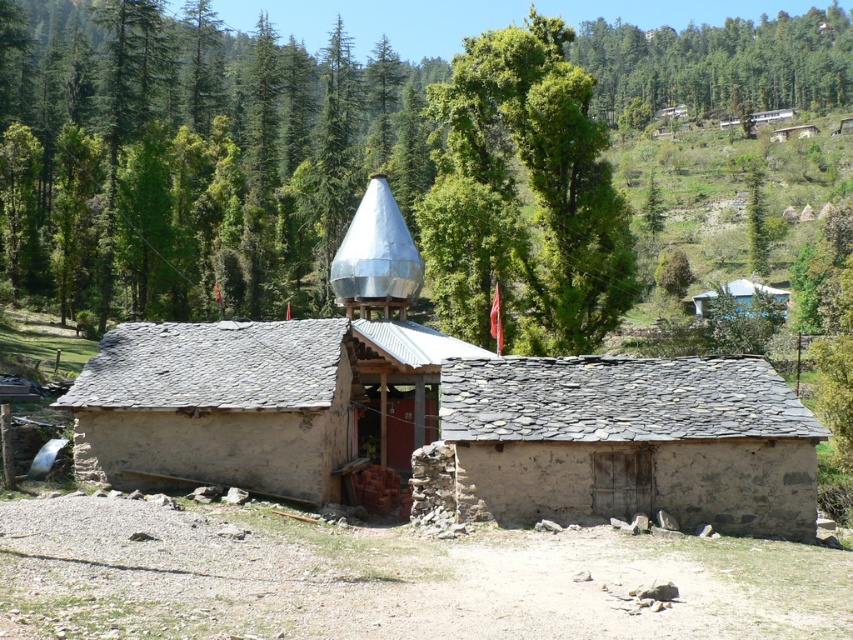
Is green leafy pine forest at upper center bigger than gray stone hut at center?

Indeed, green leafy pine forest at upper center has a larger size compared to gray stone hut at center.

Between green leafy pine forest at upper center and gray stone hut at center, which one is positioned lower?

Positioned lower is gray stone hut at center.

Is point (3, 115) positioned behind point (737, 477)?

That is True.

The image size is (853, 640). I want to click on green leafy pine forest at upper center, so click(329, 145).

Can you confirm if green leafy tree at upper center is positioned below white painted wood hut at upper right?

Incorrect, green leafy tree at upper center is not positioned below white painted wood hut at upper right.

Image resolution: width=853 pixels, height=640 pixels. What do you see at coordinates (532, 193) in the screenshot?
I see `green leafy tree at upper center` at bounding box center [532, 193].

Describe the element at coordinates (532, 193) in the screenshot. I see `green leafy tree at upper center` at that location.

Identify the location of green leafy tree at upper center. (532, 193).

Based on the photo, does gray stone hut at center have a larger size compared to green leafy tree at upper center?

Actually, gray stone hut at center might be smaller than green leafy tree at upper center.

Who is taller, gray stone hut at center or green leafy tree at upper center?

green leafy tree at upper center

You are a GUI agent. You are given a task and a screenshot of the screen. Output one action in this format:
    pyautogui.click(x=<x>, y=<y>)
    Task: Click on the gray stone hut at center
    
    Given the screenshot: What is the action you would take?
    pyautogui.click(x=631, y=442)